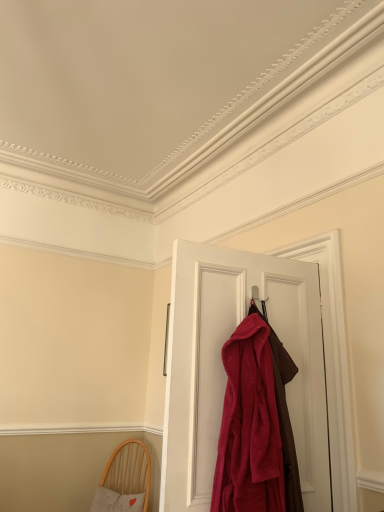
Question: Considering the relative sizes of light wood chair with cushion at lower left and velvety red robe at center in the image provided, is light wood chair with cushion at lower left thinner than velvety red robe at center?

Choices:
 (A) yes
 (B) no

Answer: (B)

Question: Is light wood chair with cushion at lower left smaller than velvety red robe at center?

Choices:
 (A) yes
 (B) no

Answer: (B)

Question: Is light wood chair with cushion at lower left behind velvety red robe at center?

Choices:
 (A) yes
 (B) no

Answer: (A)

Question: From the image's perspective, is light wood chair with cushion at lower left beneath velvety red robe at center?

Choices:
 (A) no
 (B) yes

Answer: (B)

Question: From the image's perspective, is light wood chair with cushion at lower left over velvety red robe at center?

Choices:
 (A) no
 (B) yes

Answer: (A)

Question: Would you consider light wood chair with cushion at lower left to be distant from velvety red robe at center?

Choices:
 (A) no
 (B) yes

Answer: (B)

Question: Does velvet red robe at center have a greater height compared to velvety red robe at center?

Choices:
 (A) yes
 (B) no

Answer: (A)

Question: Is velvet red robe at center shorter than velvety red robe at center?

Choices:
 (A) yes
 (B) no

Answer: (B)

Question: From the image's perspective, is velvet red robe at center under velvety red robe at center?

Choices:
 (A) yes
 (B) no

Answer: (B)

Question: Is velvet red robe at center in front of velvety red robe at center?

Choices:
 (A) yes
 (B) no

Answer: (B)

Question: Is velvet red robe at center facing towards velvety red robe at center?

Choices:
 (A) no
 (B) yes

Answer: (B)

Question: From a real-world perspective, is velvet red robe at center located beneath velvety red robe at center?

Choices:
 (A) no
 (B) yes

Answer: (A)

Question: Is light wood chair with cushion at lower left facing away from velvet red robe at center?

Choices:
 (A) no
 (B) yes

Answer: (A)